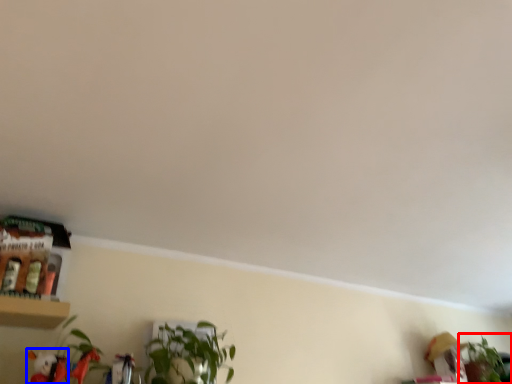
Question: Which of the following is the farthest to the observer, houseplant (highlighted by a red box) or toy (highlighted by a blue box)?

Choices:
 (A) houseplant
 (B) toy

Answer: (A)